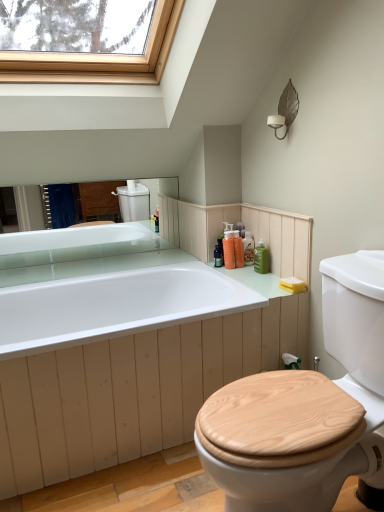
Question: From a real-world perspective, is orange plastic bottle at upper right, which appears as the second toiletry when viewed from the right, positioned over translucent orange soap at upper right, which is counted as the 3th toiletry, starting from the right, based on gravity?

Choices:
 (A) yes
 (B) no

Answer: (B)

Question: Is orange plastic bottle at upper right, marked as the third toiletry in a left-to-right arrangement, wider than translucent orange soap at upper right, positioned as the 2th toiletry in left-to-right order?

Choices:
 (A) yes
 (B) no

Answer: (B)

Question: Considering the relative positions of orange plastic bottle at upper right, marked as the third toiletry in a left-to-right arrangement, and translucent orange soap at upper right, which is counted as the 3th toiletry, starting from the right, in the image provided, is orange plastic bottle at upper right, marked as the third toiletry in a left-to-right arrangement, to the right of translucent orange soap at upper right, which is counted as the 3th toiletry, starting from the right, from the viewer's perspective?

Choices:
 (A) no
 (B) yes

Answer: (B)

Question: From a real-world perspective, is orange plastic bottle at upper right, which appears as the second toiletry when viewed from the right, below translucent orange soap at upper right, positioned as the 2th toiletry in left-to-right order?

Choices:
 (A) yes
 (B) no

Answer: (A)

Question: Is the position of orange plastic bottle at upper right, which appears as the second toiletry when viewed from the right, more distant than that of translucent orange soap at upper right, positioned as the 2th toiletry in left-to-right order?

Choices:
 (A) no
 (B) yes

Answer: (B)

Question: In the image, is wooden at right positioned in front of or behind orange plastic bottle at upper right, which appears as the second toiletry when viewed from the right?

Choices:
 (A) behind
 (B) front

Answer: (B)

Question: From a real-world perspective, is wooden at right physically located above or below orange plastic bottle at upper right, which appears as the second toiletry when viewed from the right?

Choices:
 (A) below
 (B) above

Answer: (A)

Question: Looking at the image, does wooden at right seem bigger or smaller compared to orange plastic bottle at upper right, which appears as the second toiletry when viewed from the right?

Choices:
 (A) small
 (B) big

Answer: (B)

Question: From the image's perspective, relative to orange plastic bottle at upper right, marked as the third toiletry in a left-to-right arrangement, is wooden at right above or below?

Choices:
 (A) above
 (B) below

Answer: (B)

Question: Is yellow sponge at right taller or shorter than wooden at right?

Choices:
 (A) tall
 (B) short

Answer: (B)

Question: Is point (289, 287) closer or farther from the camera than point (329, 328)?

Choices:
 (A) farther
 (B) closer

Answer: (A)

Question: Is yellow sponge at right in front of or behind wooden at right in the image?

Choices:
 (A) behind
 (B) front

Answer: (A)

Question: Is yellow sponge at right bigger or smaller than wooden at right?

Choices:
 (A) small
 (B) big

Answer: (A)

Question: Based on their sizes in the image, would you say yellow sponge at right is bigger or smaller than translucent orange soap at upper right, positioned as the 2th toiletry in left-to-right order?

Choices:
 (A) small
 (B) big

Answer: (A)

Question: Relative to translucent orange soap at upper right, which is counted as the 3th toiletry, starting from the right, is yellow sponge at right in front or behind?

Choices:
 (A) behind
 (B) front

Answer: (B)